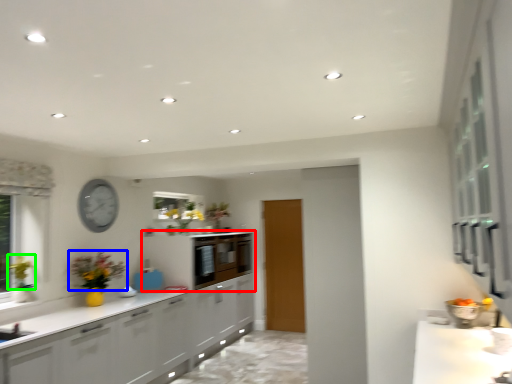
Question: Based on their relative distances, which object is nearer to cabinetry (highlighted by a red box)? Choose from flower (highlighted by a blue box) and floral arrangement (highlighted by a green box).

Choices:
 (A) flower
 (B) floral arrangement

Answer: (A)